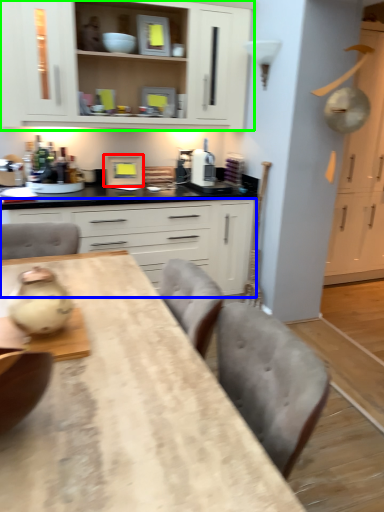
Question: Which object is positioned closest to appliance (highlighted by a red box)? Select from cabinetry (highlighted by a blue box) and cabinetry (highlighted by a green box).

Choices:
 (A) cabinetry
 (B) cabinetry

Answer: (A)